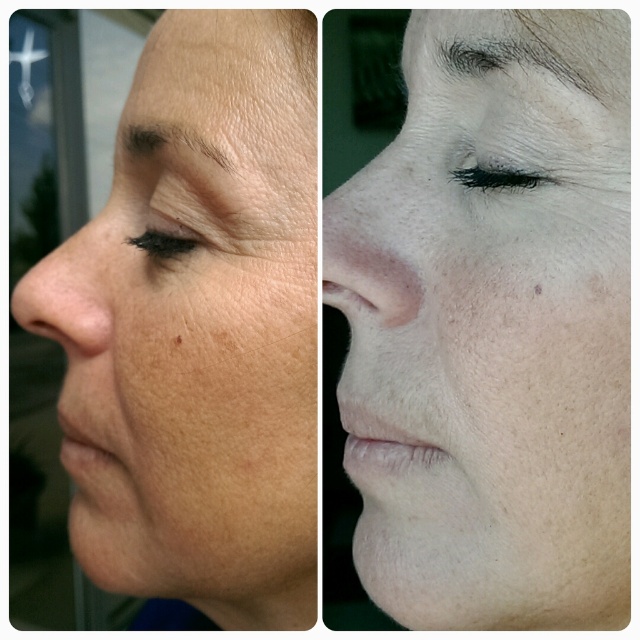
Does smooth skin nose at center appear on the right side of smooth skin nose at left?

Correct, you'll find smooth skin nose at center to the right of smooth skin nose at left.

Image resolution: width=640 pixels, height=640 pixels. Describe the element at coordinates (365, 252) in the screenshot. I see `smooth skin nose at center` at that location.

Locate an element on the screen. smooth skin nose at center is located at coordinates (365, 252).

Which is in front, point (314, 83) or point (147, 241)?

Positioned in front is point (314, 83).

Does dry skin at upper left have a greater height compared to matte skin eye at left?

Correct, dry skin at upper left is much taller as matte skin eye at left.

Find the location of a particular element. Image resolution: width=640 pixels, height=640 pixels. dry skin at upper left is located at coordinates (301, 44).

Where is `dry skin at upper left`? This screenshot has height=640, width=640. dry skin at upper left is located at coordinates (301, 44).

Can you confirm if smooth skin nose at left is smaller than gray matte eyebrow at upper center?

No, smooth skin nose at left is not smaller than gray matte eyebrow at upper center.

Does smooth skin nose at left have a lesser height compared to gray matte eyebrow at upper center?

No.

The image size is (640, 640). In order to click on smooth skin nose at left in this screenshot , I will do `click(67, 298)`.